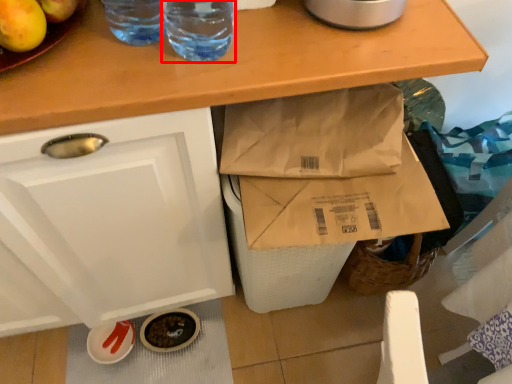
Question: From the image's perspective, considering the relative positions of drinking straw (annotated by the red box) and drinking straw in the image provided, where is drinking straw (annotated by the red box) located with respect to the staircase?

Choices:
 (A) above
 (B) below

Answer: (B)